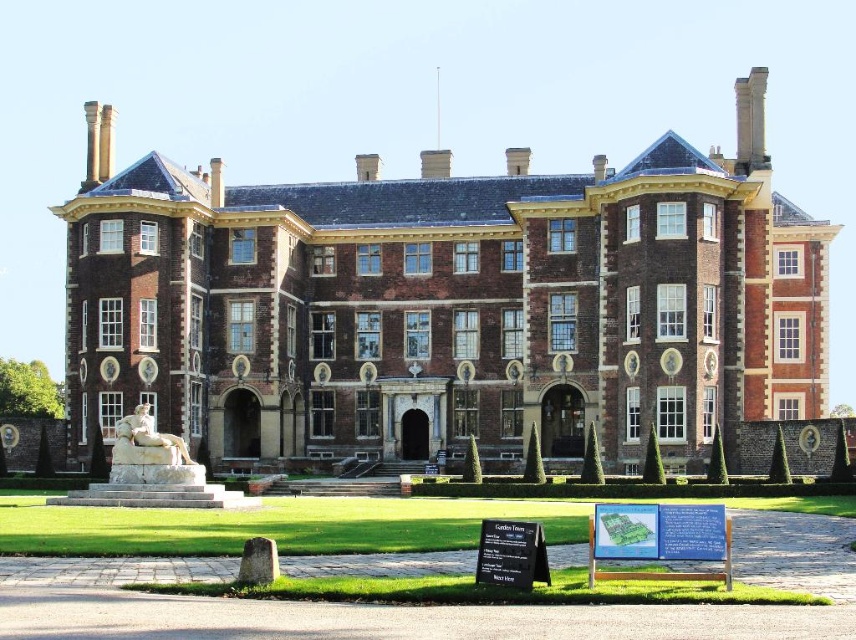
Can you confirm if brown brick mansion at center is positioned below white marble statue at lower left?

Incorrect, brown brick mansion at center is not positioned below white marble statue at lower left.

Consider the image. Between brown brick mansion at center and white marble statue at lower left, which one has more height?

With more height is brown brick mansion at center.

I want to click on brown brick mansion at center, so click(446, 307).